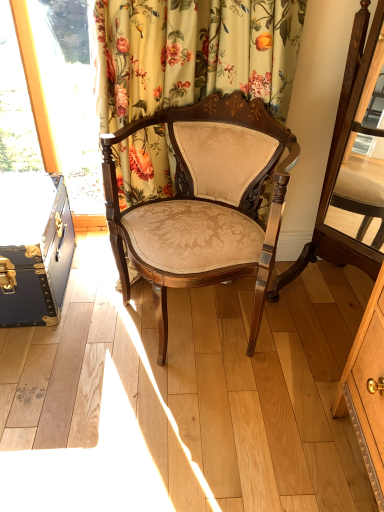
Question: Is point (66, 229) positioned closer to the camera than point (246, 230)?

Choices:
 (A) closer
 (B) farther

Answer: (B)

Question: Looking at the image, does blue leather suitcase at left seem bigger or smaller compared to matte gold upholstery chair at center?

Choices:
 (A) big
 (B) small

Answer: (B)

Question: Considering the real-world distances, which object is farthest from the matte brown wood swivel chair at center?

Choices:
 (A) floral fabric curtain at upper center
 (B) matte gold upholstery chair at center
 (C) blue leather suitcase at left

Answer: (C)

Question: Which object is positioned closest to the matte brown wood swivel chair at center?

Choices:
 (A) matte gold upholstery chair at center
 (B) blue leather suitcase at left
 (C) floral fabric curtain at upper center

Answer: (A)